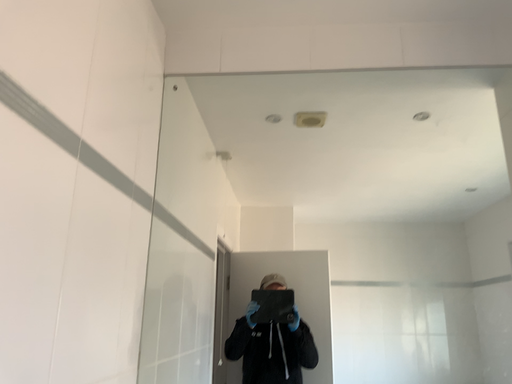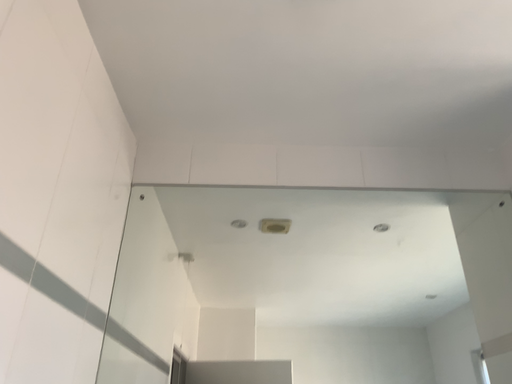
Question: Which way did the camera rotate in the video?

Choices:
 (A) rotated downward
 (B) rotated upward

Answer: (B)